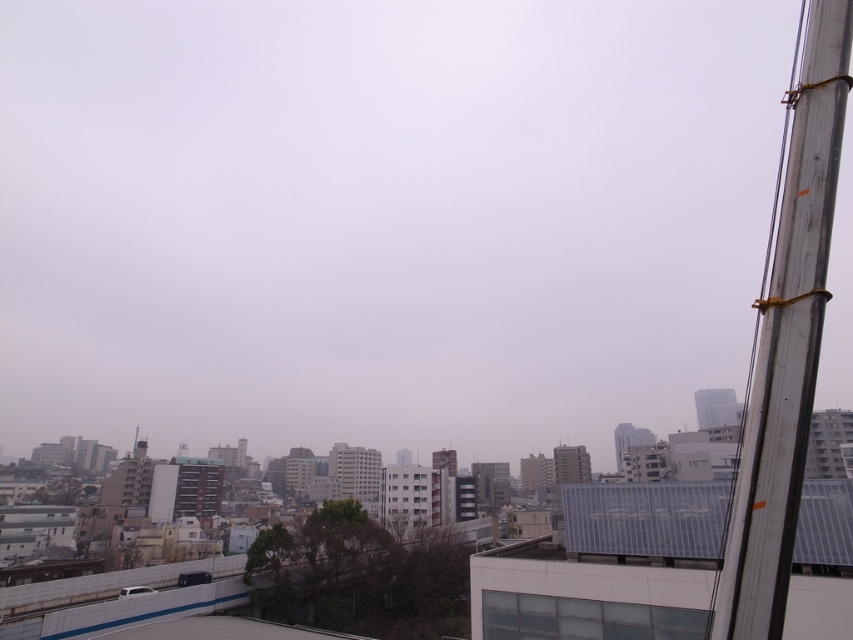
You are standing on the rooftop and want to locate the metallic gray pole at right. What are its coordinates in the image?

The metallic gray pole at right is located at coordinates 0.537 on the x axis and 0.923 on the y axis.

You are standing on a rooftop and looking out at the city. There is a point marked at coordinates (786,342). What object does this point correspond to?

The point corresponds to the metallic gray pole at right.